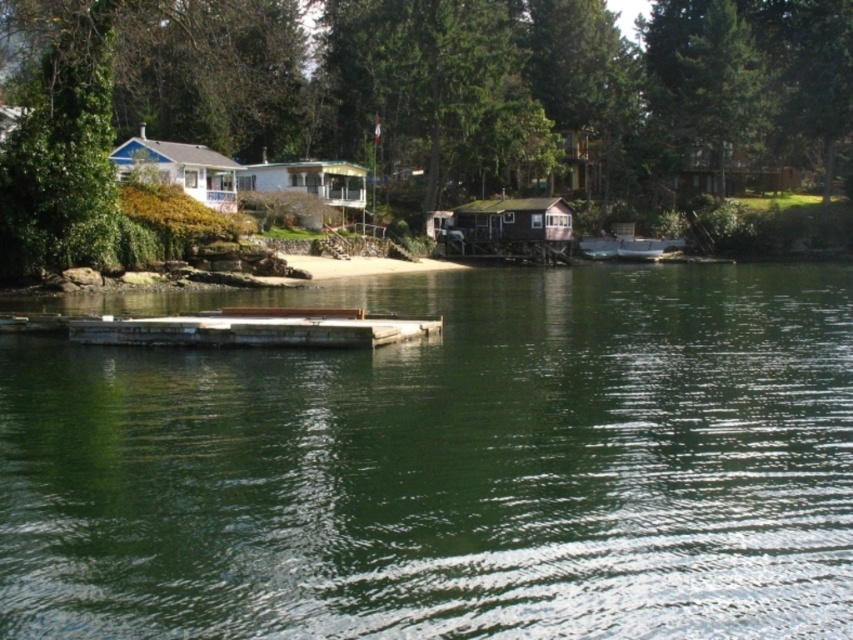
Who is positioned more to the right, green smooth water at center or wooden dock at center?

From the viewer's perspective, green smooth water at center appears more on the right side.

Is point (759, 308) farther from viewer compared to point (277, 326)?

Yes, it is.

Locate an element on the screen. green smooth water at center is located at coordinates (447, 465).

Does green leafy tree at upper center have a larger size compared to green leafy tree at left?

Correct, green leafy tree at upper center is larger in size than green leafy tree at left.

What are the coordinates of `green leafy tree at upper center` in the screenshot? It's located at (415, 104).

Image resolution: width=853 pixels, height=640 pixels. In order to click on green leafy tree at upper center in this screenshot , I will do `click(415, 104)`.

Which of these two, green smooth water at center or wooden boat at center, stands taller?

wooden boat at center

Who is positioned more to the left, green smooth water at center or wooden boat at center?

green smooth water at center is more to the left.

Who is more distant from viewer, (486,605) or (585,250)?

Point (585,250)

The width and height of the screenshot is (853, 640). I want to click on green smooth water at center, so click(x=447, y=465).